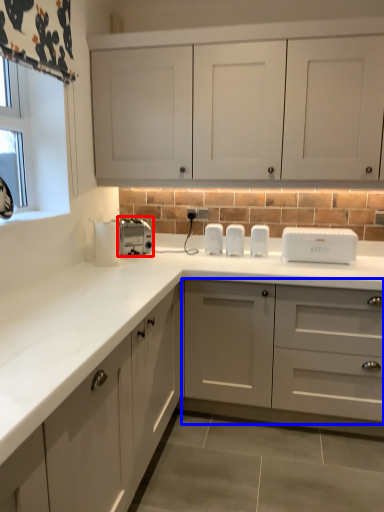
Question: Which point is further to the camera, toaster (highlighted by a red box) or cabinetry (highlighted by a blue box)?

Choices:
 (A) toaster
 (B) cabinetry

Answer: (A)